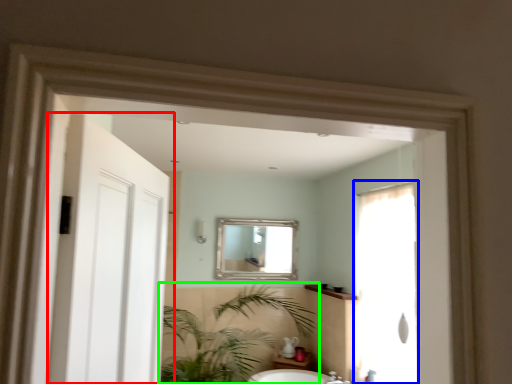
Question: Considering the real-world distances, which object is farthest from door (highlighted by a red box)? screen door (highlighted by a blue box) or houseplant (highlighted by a green box)?

Choices:
 (A) screen door
 (B) houseplant

Answer: (B)